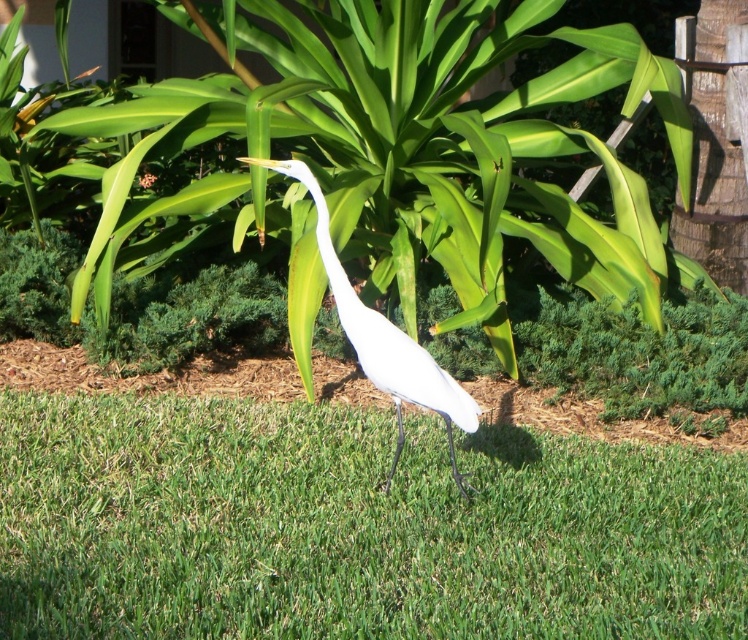
Between point (392, 417) and point (426, 356), which one is positioned behind?

Positioned behind is point (392, 417).

Can you confirm if green grass at center is taller than white matte bird at center?

No, green grass at center is not taller than white matte bird at center.

Identify the location of green grass at center. (352, 525).

Find the location of a particular element. This screenshot has height=640, width=748. green grass at center is located at coordinates (352, 525).